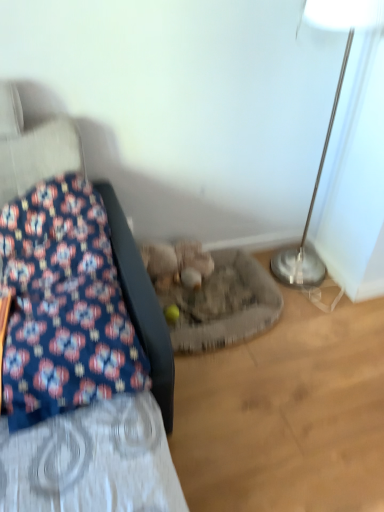
Locate an element on the screen. The width and height of the screenshot is (384, 512). free space in front of silver metallic floor lamp at right is located at coordinates (327, 320).